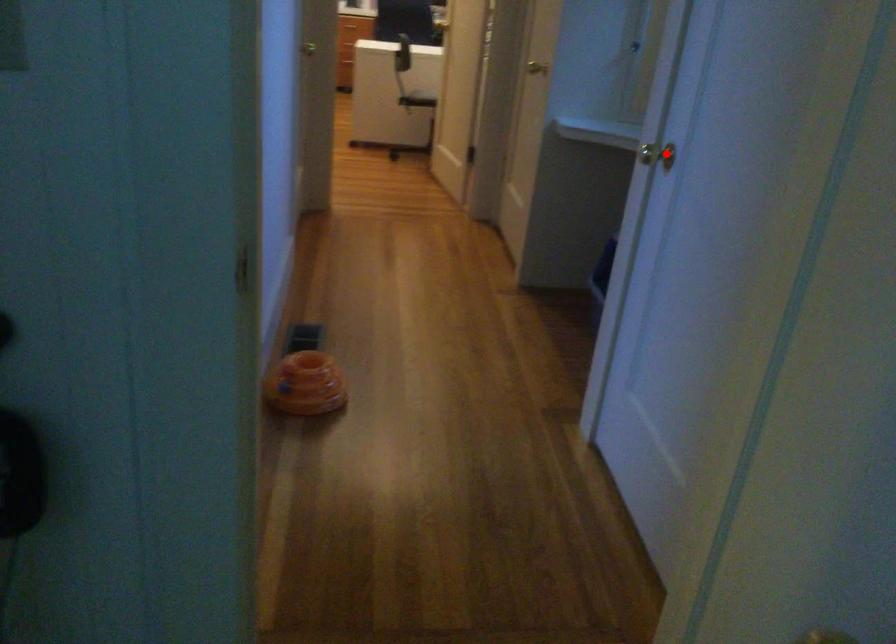
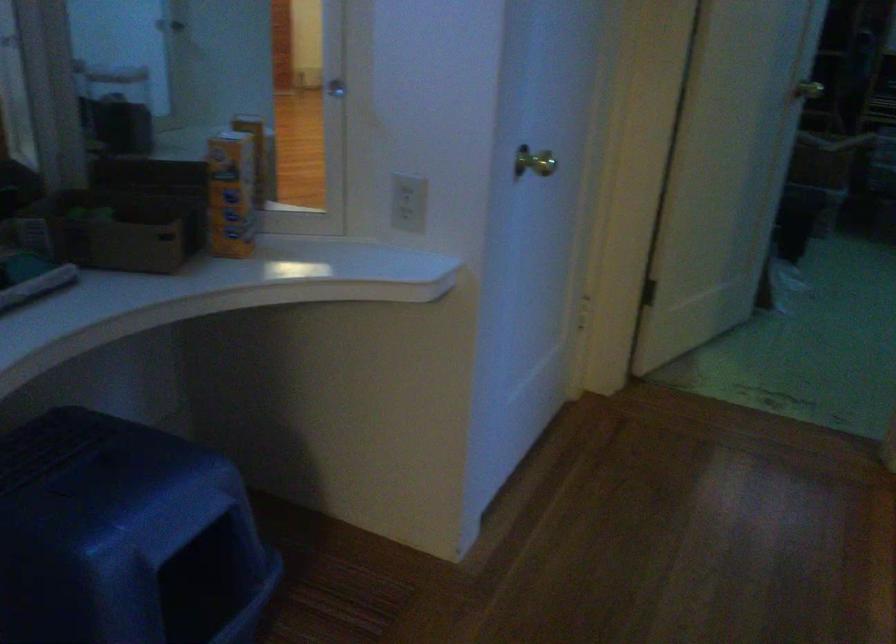
Question: I am providing you with two images of the same scene from different viewpoints. Given a red point in image1, look at the same physical point in image2. Is it:

Choices:
 (A) Closer to the viewpoint
 (B) Farther from the viewpoint

Answer: (A)